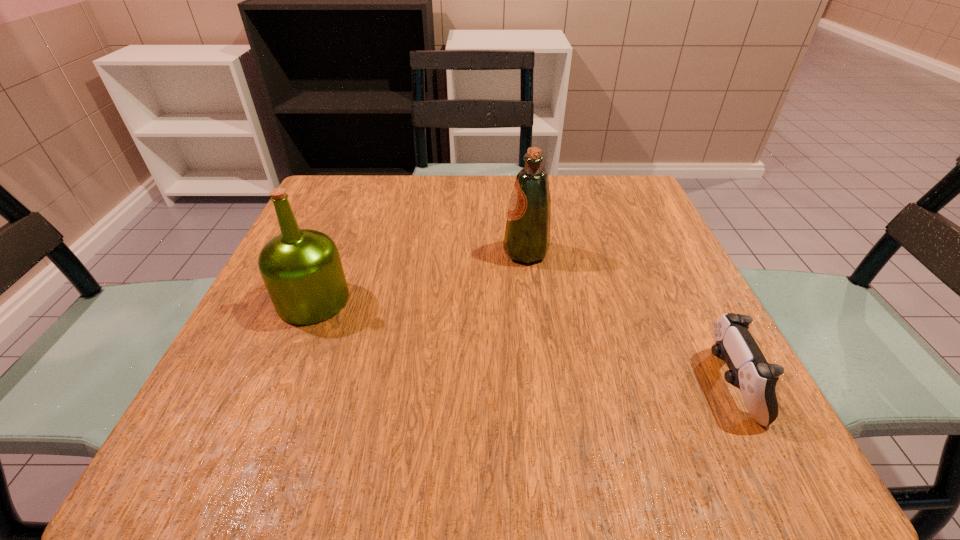
Where is `free space that is in between the second object from left to right and the leftmost object`? Image resolution: width=960 pixels, height=540 pixels. free space that is in between the second object from left to right and the leftmost object is located at coordinates (420, 276).

Find the location of a particular element. This screenshot has width=960, height=540. blank region between the second nearest object and the control is located at coordinates (521, 342).

Identify which object is the second nearest to the right olive oil. Please provide its 2D coordinates. Your answer should be formatted as a tuple, i.e. [(x, y)], where the tuple contains the x and y coordinates of a point satisfying the conditions above.

[(301, 268)]

Choose which object is the nearest neighbor to the second farthest object. Please provide its 2D coordinates. Your answer should be formatted as a tuple, i.e. [(x, y)], where the tuple contains the x and y coordinates of a point satisfying the conditions above.

[(527, 234)]

The width and height of the screenshot is (960, 540). Identify the location of vacant region that satisfies the following two spatial constraints: 1. on the front-facing side of the right olive oil; 2. on the front side of the leftmost object. (532, 300).